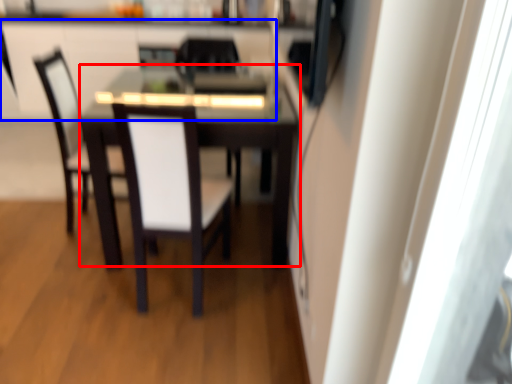
Question: Among these objects, which one is nearest to the camera, table (highlighted by a red box) or cabinetry (highlighted by a blue box)?

Choices:
 (A) table
 (B) cabinetry

Answer: (A)